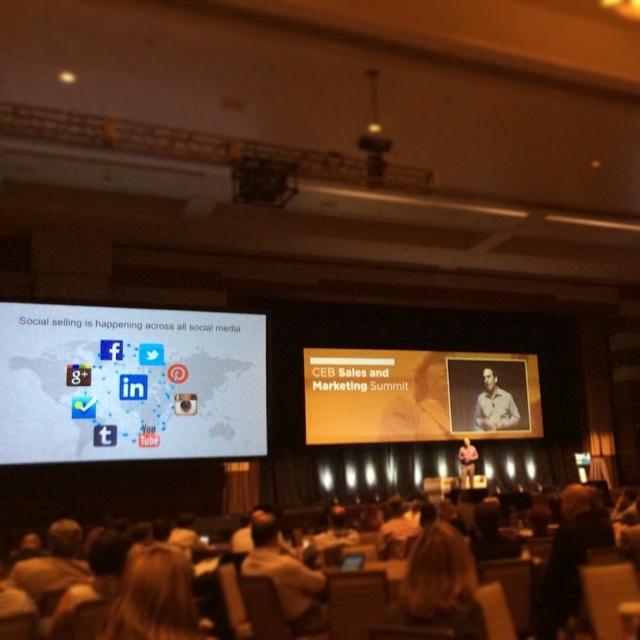
Question: Which is farther from the orange matte projection screen at center?

Choices:
 (A) blonde hair at lower center
 (B) light brown leather jacket at center
 (C) light beige shirt at center
 (D) light brown leather jacket at lower center

Answer: (A)

Question: Is white matte projection screen at lower left further to the viewer compared to blonde hair at lower center?

Choices:
 (A) yes
 (B) no

Answer: (A)

Question: Is orange matte projection screen at center smaller than blonde hair at lower center?

Choices:
 (A) yes
 (B) no

Answer: (B)

Question: Among these points, which one is farthest from the camera?

Choices:
 (A) (408, 436)
 (B) (259, 541)
 (C) (140, 611)

Answer: (A)

Question: Which of the following is the farthest from the observer?

Choices:
 (A) light brown leather jacket at lower center
 (B) light brown leather jacket at center
 (C) white matte projection screen at lower left

Answer: (B)

Question: Does orange matte projection screen at center have a larger size compared to blonde hair at lower center?

Choices:
 (A) no
 (B) yes

Answer: (B)